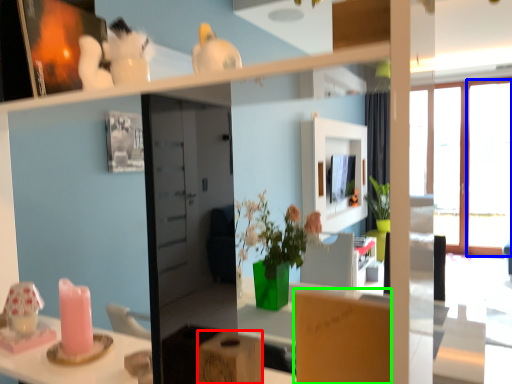
Question: Which object is the closest to the cardboard box (highlighted by a red box)? Choose among these: window (highlighted by a blue box) or cardboard box (highlighted by a green box).

Choices:
 (A) window
 (B) cardboard box

Answer: (B)